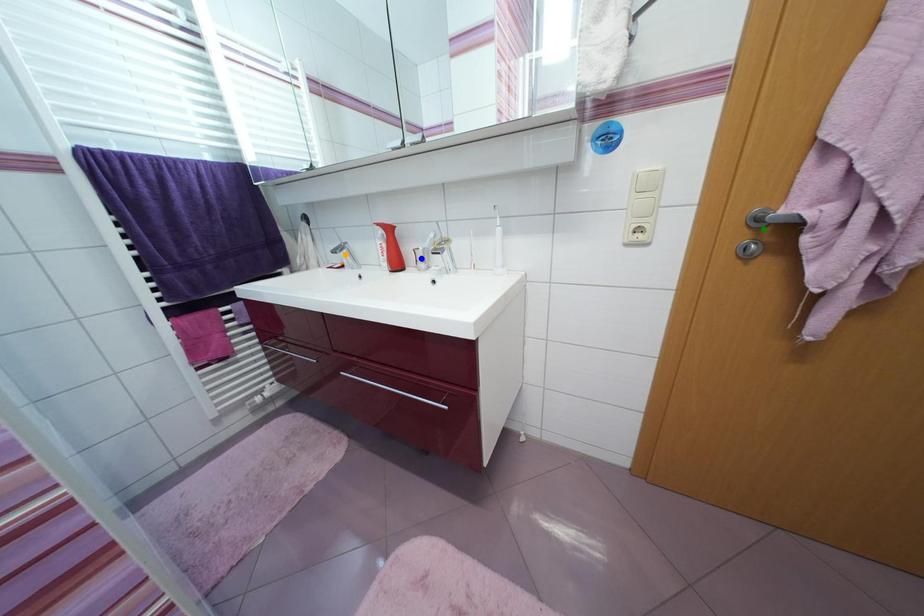
Order these from farthest to nearest:
A) green point
B) orange point
C) blue point

orange point
blue point
green point